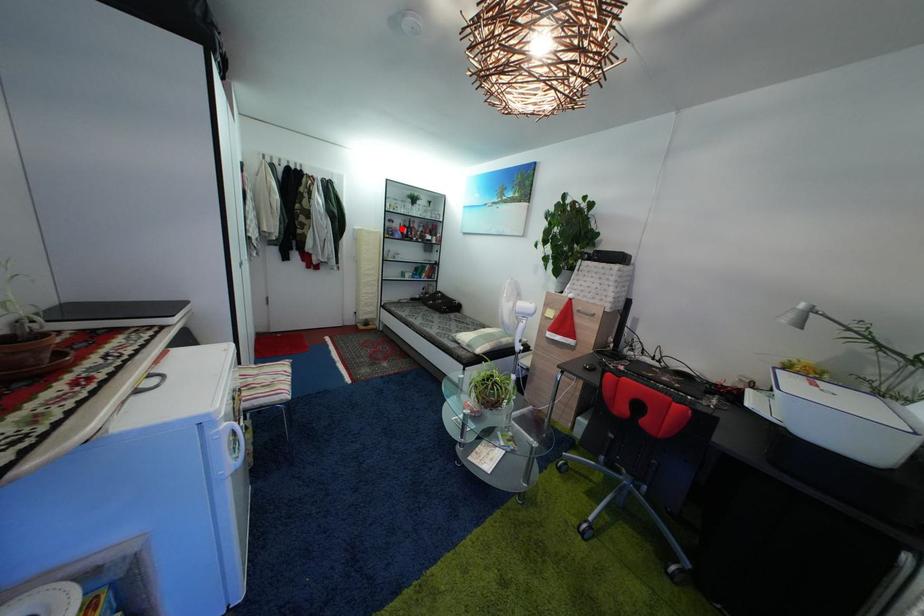
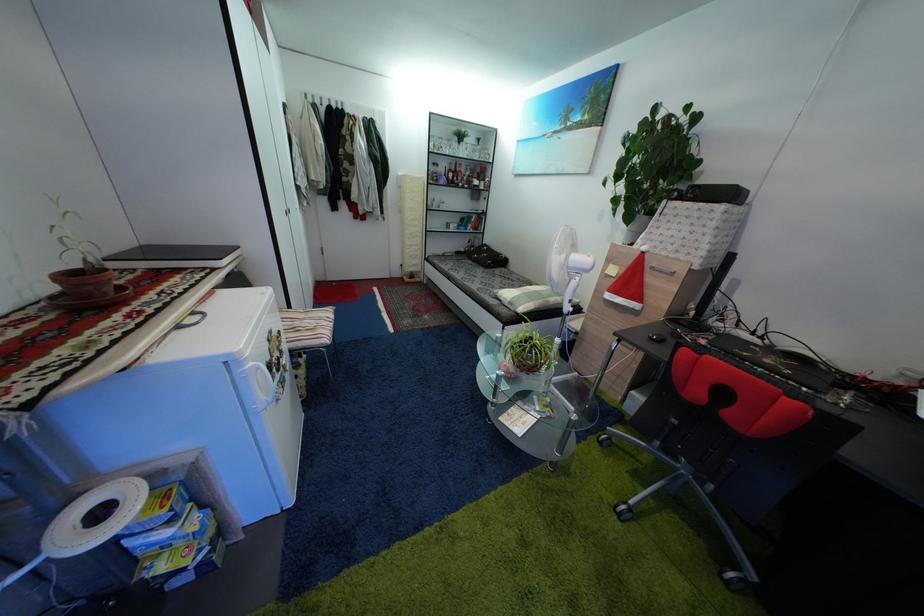
Question: I am providing you with two images of the same scene from different viewpoints. A red point is shown in image1. For the corresponding object point in image2, is it positioned nearer or farther from the camera?

Choices:
 (A) Nearer
 (B) Farther

Answer: (A)